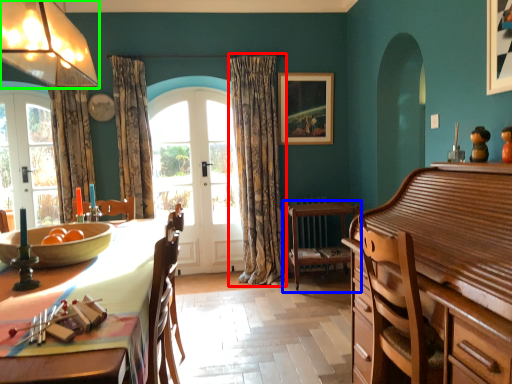
Question: Based on their relative distances, which object is nearer to curtain (highlighted by a red box)? Choose from chair (highlighted by a blue box) and lamp (highlighted by a green box).

Choices:
 (A) chair
 (B) lamp

Answer: (A)